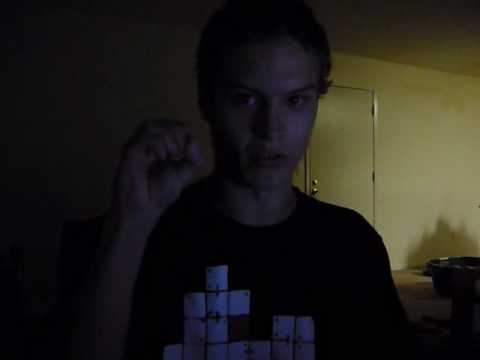
Where is `wall`? The height and width of the screenshot is (360, 480). wall is located at coordinates (452, 190).